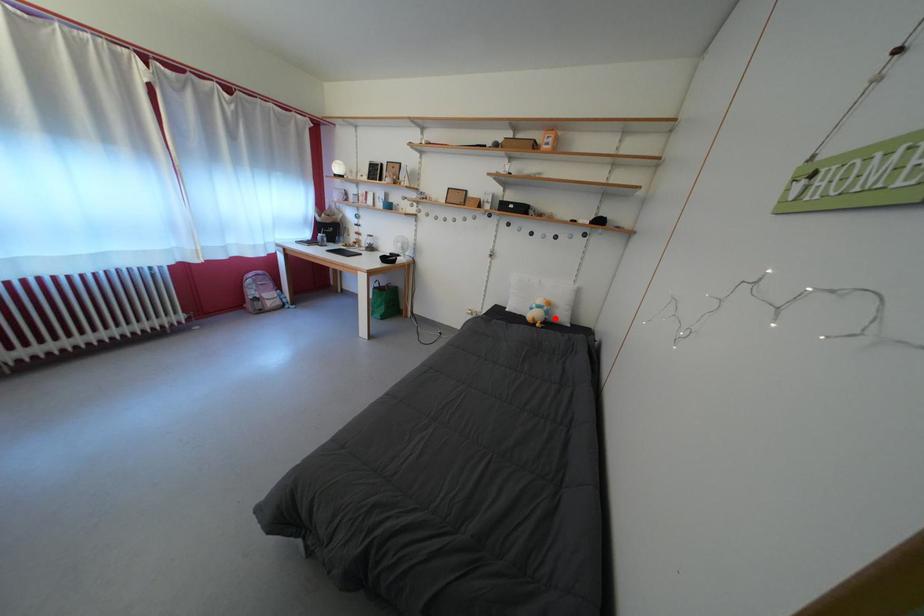
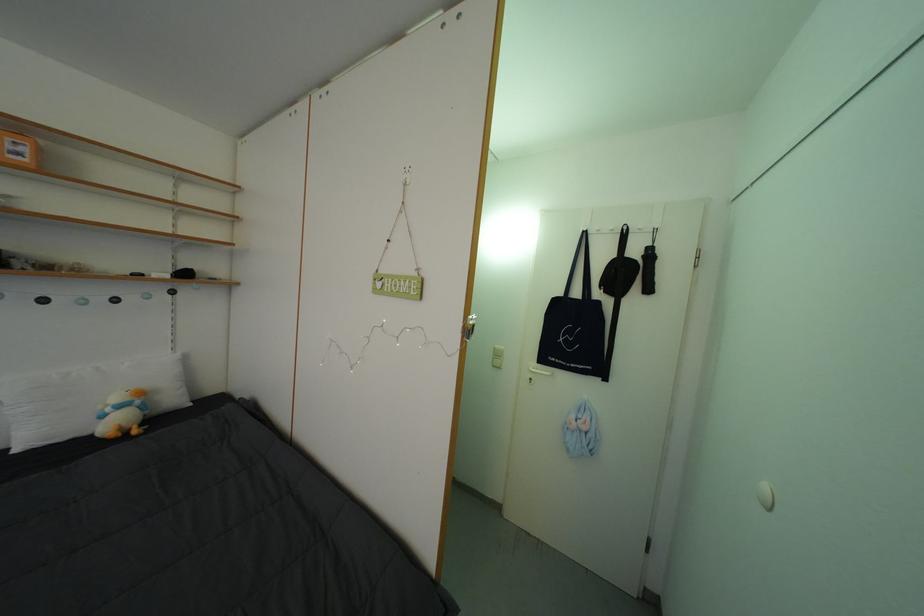
Question: I am providing you with two images of the same scene from different viewpoints. In image1, a red point is highlighted. Considering the same 3D point in image2, which of the following is correct?

Choices:
 (A) It is closer
 (B) It is farther

Answer: (B)